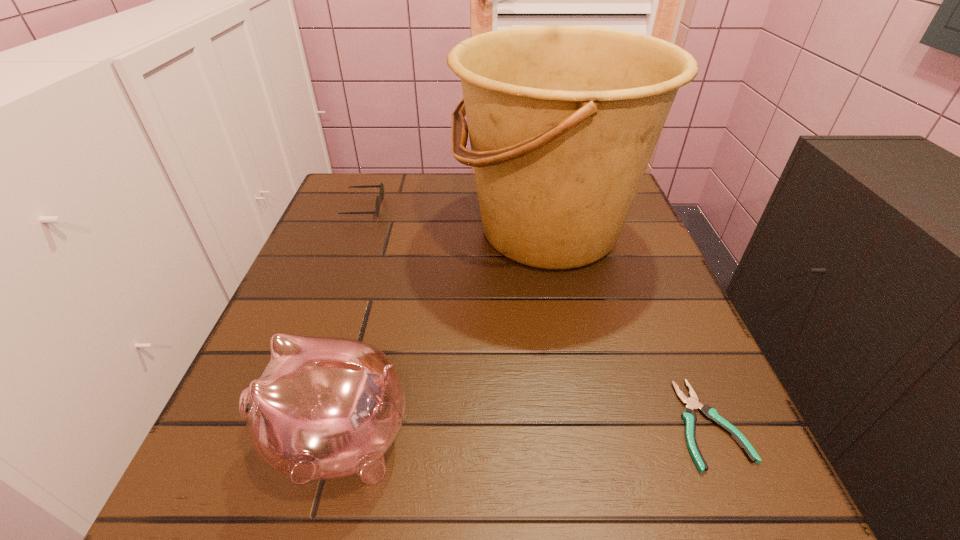
Where is `empty space that is in between the sunglasses and the piggy bank`? The height and width of the screenshot is (540, 960). empty space that is in between the sunglasses and the piggy bank is located at coordinates (351, 324).

What are the coordinates of `free space between the tallest object and the pliers` in the screenshot? It's located at (629, 328).

Find the location of a particular element. The width and height of the screenshot is (960, 540). vacant area that lies between the pliers and the second tallest object is located at coordinates (524, 433).

The width and height of the screenshot is (960, 540). Identify the location of free space that is in between the piggy bank and the shortest object. (524, 433).

The width and height of the screenshot is (960, 540). Identify the location of free point between the bucket and the second tallest object. (444, 336).

In order to click on free space between the pliers and the sunglasses in this screenshot , I will do [x=537, y=316].

Image resolution: width=960 pixels, height=540 pixels. What are the coordinates of `vacant space that's between the bucket and the third tallest object` in the screenshot? It's located at (456, 219).

Where is `free spot between the sunglasses and the tallest object`? free spot between the sunglasses and the tallest object is located at coordinates (456, 219).

The width and height of the screenshot is (960, 540). What are the coordinates of `object that is the second closest to the sunglasses` in the screenshot? It's located at (324, 408).

Identify which object is the closest to the third shortest object. Please provide its 2D coordinates. Your answer should be formatted as a tuple, i.e. [(x, y)], where the tuple contains the x and y coordinates of a point satisfying the conditions above.

[(563, 120)]